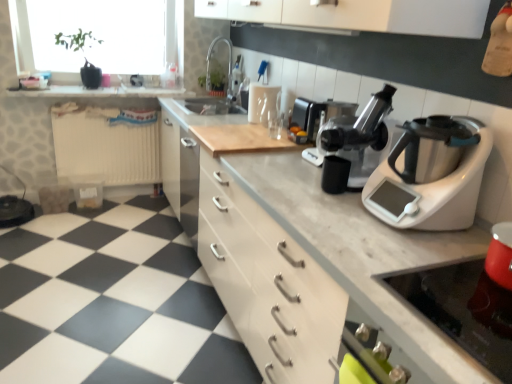
Question: From the image's perspective, is matte silver sink at upper center over transparent glass window screen at upper left?

Choices:
 (A) no
 (B) yes

Answer: (A)

Question: Is matte silver sink at upper center in front of transparent glass window screen at upper left?

Choices:
 (A) yes
 (B) no

Answer: (A)

Question: Is matte silver sink at upper center looking in the opposite direction of transparent glass window screen at upper left?

Choices:
 (A) yes
 (B) no

Answer: (B)

Question: Considering the relative sizes of matte silver sink at upper center and transparent glass window screen at upper left in the image provided, is matte silver sink at upper center wider than transparent glass window screen at upper left?

Choices:
 (A) yes
 (B) no

Answer: (A)

Question: Is matte silver sink at upper center positioned beyond the bounds of transparent glass window screen at upper left?

Choices:
 (A) no
 (B) yes

Answer: (B)

Question: From a real-world perspective, is transparent glass window screen at upper left above or below white marble countertop at center?

Choices:
 (A) below
 (B) above

Answer: (B)

Question: Considering the positions of transparent glass window screen at upper left and white marble countertop at center in the image, is transparent glass window screen at upper left wider or thinner than white marble countertop at center?

Choices:
 (A) thin
 (B) wide

Answer: (A)

Question: Does point 90,51 appear closer or farther from the camera than point 292,223?

Choices:
 (A) closer
 (B) farther

Answer: (B)

Question: From the image's perspective, is transparent glass window screen at upper left positioned above or below white marble countertop at center?

Choices:
 (A) above
 (B) below

Answer: (A)

Question: Does point (292, 316) appear closer or farther from the camera than point (62, 94)?

Choices:
 (A) farther
 (B) closer

Answer: (B)

Question: In the image, is white marble countertop at center on the left side or the right side of white marble cutting board at upper center?

Choices:
 (A) left
 (B) right

Answer: (B)

Question: In terms of height, does white marble countertop at center look taller or shorter compared to white marble cutting board at upper center?

Choices:
 (A) tall
 (B) short

Answer: (A)

Question: Looking at the image, does white marble countertop at center seem bigger or smaller compared to white marble cutting board at upper center?

Choices:
 (A) small
 (B) big

Answer: (B)

Question: Visually, is white marble countertop at center positioned to the left or to the right of black plastic juicer at center?

Choices:
 (A) left
 (B) right

Answer: (A)

Question: Is point (202, 129) closer or farther from the camera than point (373, 148)?

Choices:
 (A) closer
 (B) farther

Answer: (B)